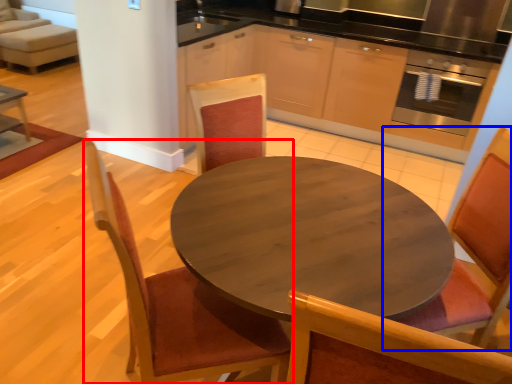
Question: Which point is closer to the camera, chair (highlighted by a red box) or chair (highlighted by a blue box)?

Choices:
 (A) chair
 (B) chair

Answer: (A)